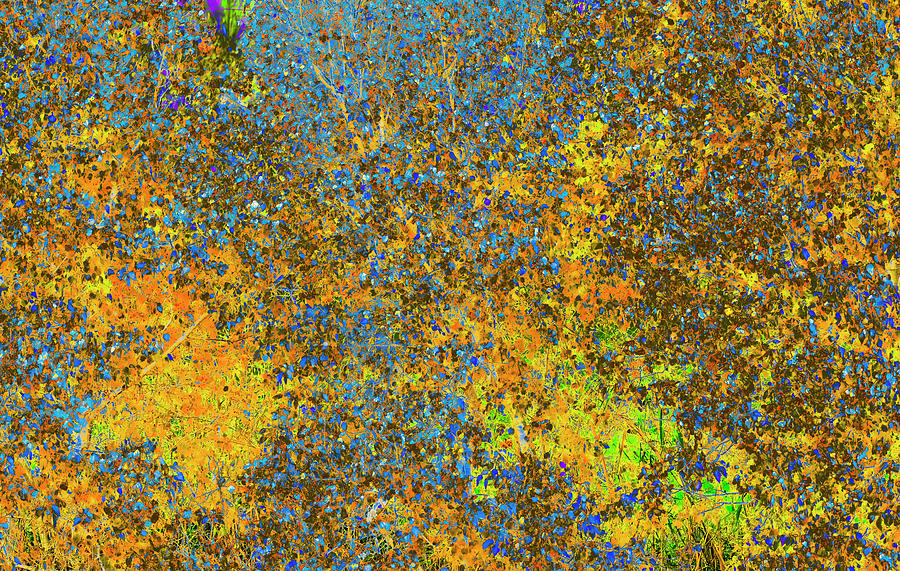
Where is `right side of canopy`? This screenshot has width=900, height=571. right side of canopy is located at coordinates (875, 293).